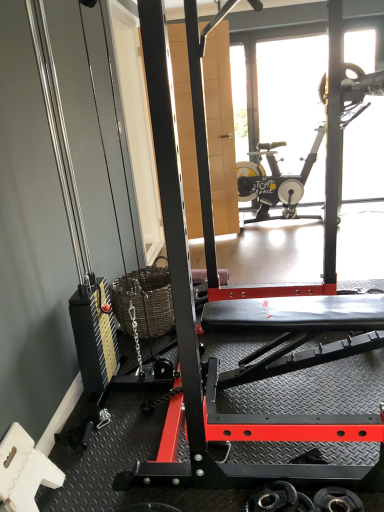
Question: From a real-world perspective, is transparent glass door at upper center beneath black rubber weight at lower right, the 2th wheel viewed from the left?

Choices:
 (A) no
 (B) yes

Answer: (A)

Question: Is transparent glass door at upper center with black rubber weight at lower right, arranged as the first wheel when viewed from the right?

Choices:
 (A) no
 (B) yes

Answer: (A)

Question: Does transparent glass door at upper center come behind black rubber weight at lower right, the 2th wheel viewed from the left?

Choices:
 (A) no
 (B) yes

Answer: (B)

Question: Is transparent glass door at upper center bigger than black rubber weight at lower right, arranged as the first wheel when viewed from the right?

Choices:
 (A) yes
 (B) no

Answer: (A)

Question: From the image's perspective, is transparent glass door at upper center below black rubber weight at lower right, arranged as the first wheel when viewed from the right?

Choices:
 (A) yes
 (B) no

Answer: (B)

Question: Is transparent glass door at upper center completely or partially outside of black rubber weight at lower right, the 2th wheel viewed from the left?

Choices:
 (A) no
 (B) yes

Answer: (B)

Question: Can you confirm if black rubber weight at lower right, the 2th wheel viewed from the left, is wider than metallic black weight at lower center, acting as the 1th wheel starting from the left?

Choices:
 (A) no
 (B) yes

Answer: (A)

Question: Considering the relative sizes of black rubber weight at lower right, the 2th wheel viewed from the left, and metallic black weight at lower center, the 2th wheel in the right-to-left sequence, in the image provided, is black rubber weight at lower right, the 2th wheel viewed from the left, shorter than metallic black weight at lower center, the 2th wheel in the right-to-left sequence,?

Choices:
 (A) no
 (B) yes

Answer: (B)

Question: Does black rubber weight at lower right, arranged as the first wheel when viewed from the right, appear on the left side of metallic black weight at lower center, acting as the 1th wheel starting from the left?

Choices:
 (A) yes
 (B) no

Answer: (B)

Question: Considering the relative sizes of black rubber weight at lower right, arranged as the first wheel when viewed from the right, and metallic black weight at lower center, acting as the 1th wheel starting from the left, in the image provided, is black rubber weight at lower right, arranged as the first wheel when viewed from the right, taller than metallic black weight at lower center, acting as the 1th wheel starting from the left,?

Choices:
 (A) yes
 (B) no

Answer: (B)

Question: Is black rubber weight at lower right, the 2th wheel viewed from the left, at the right side of metallic black weight at lower center, the 2th wheel in the right-to-left sequence?

Choices:
 (A) yes
 (B) no

Answer: (A)

Question: From the image's perspective, is black rubber weight at lower right, the 2th wheel viewed from the left, over metallic black weight at lower center, the 2th wheel in the right-to-left sequence?

Choices:
 (A) yes
 (B) no

Answer: (A)

Question: Considering the relative sizes of black rubber weight at lower right, arranged as the first wheel when viewed from the right, and transparent glass door at upper center in the image provided, is black rubber weight at lower right, arranged as the first wheel when viewed from the right, taller than transparent glass door at upper center?

Choices:
 (A) no
 (B) yes

Answer: (A)